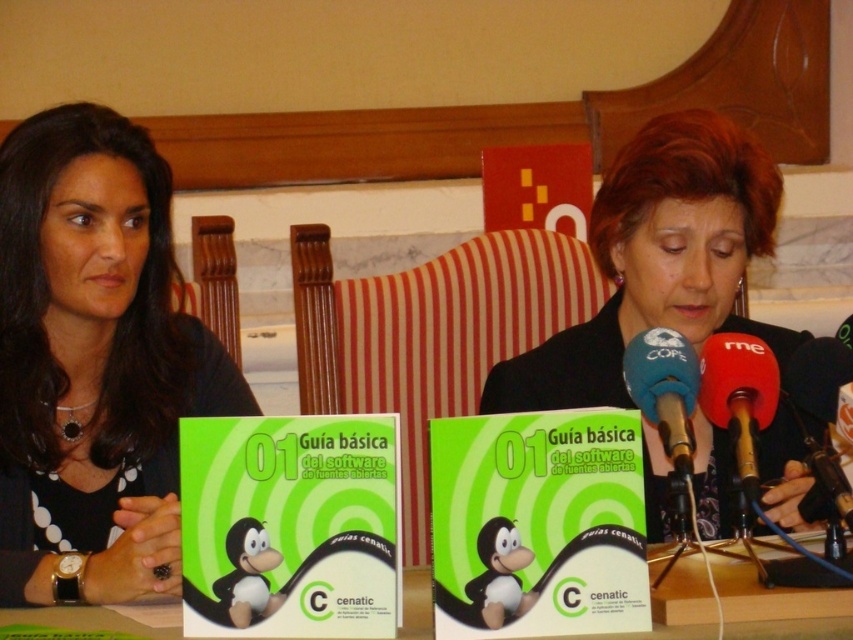
Looking at this image, measure the distance between matte black shirt at left and camera.

4.19 feet

From the picture: Is matte black shirt at left smaller than black fabric jacket at center?

Yes, matte black shirt at left is smaller than black fabric jacket at center.

This screenshot has height=640, width=853. Find the location of `matte black shirt at left`. matte black shirt at left is located at coordinates (93, 356).

Identify the location of matte black shirt at left. (93, 356).

Who is more forward, [643,273] or [643,364]?

Point [643,364] is in front.

Consider the image. Measure the distance between point (762, 225) and camera.

Point (762, 225) and camera are 1.60 meters apart from each other.

Is point (721, 218) farther from camera compared to point (677, 442)?

Yes, it is behind point (677, 442).

The width and height of the screenshot is (853, 640). Identify the location of black fabric jacket at center. (659, 260).

Which is behind, point (643, 307) or point (96, 620)?

The point (643, 307) is more distant.

Who is positioned more to the left, black fabric jacket at center or green paper at center?

Positioned to the left is green paper at center.

Between point (743, 157) and point (645, 636), which one is positioned in front?

Point (645, 636) is more forward.

Find the location of a particular element. The width and height of the screenshot is (853, 640). black fabric jacket at center is located at coordinates (659, 260).